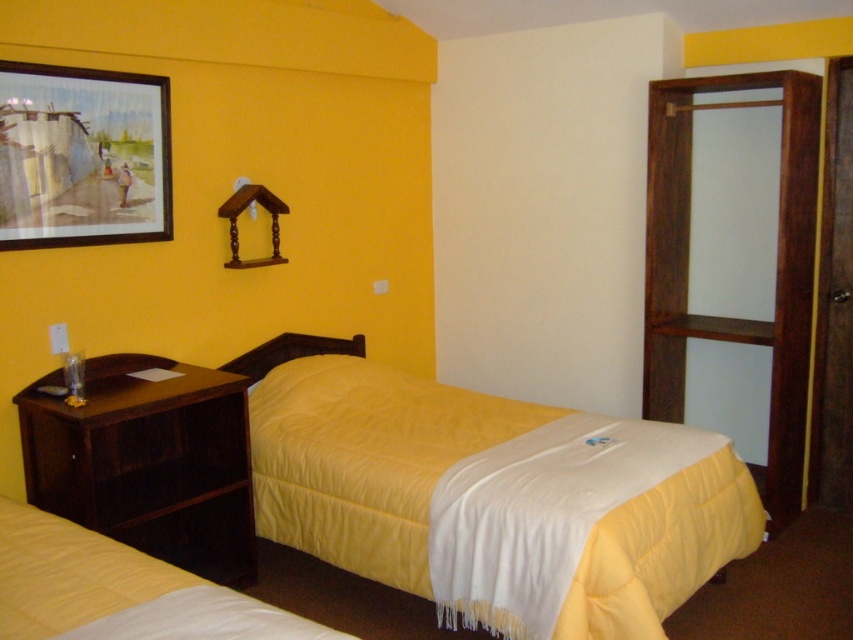
Based on the photo, you are an interior designer planning to add a new shelf to this bedroom. The shelf will be placed between the wooden framed painting at upper left and the yellow quilted bedcover at lower left. Considering their heights, which object should the shelf be positioned closer to?

The shelf should be positioned closer to the wooden framed painting at upper left because it is much taller than the yellow quilted bedcover at lower left, so placing the shelf near the taller object would maintain balance and visual harmony in the room.